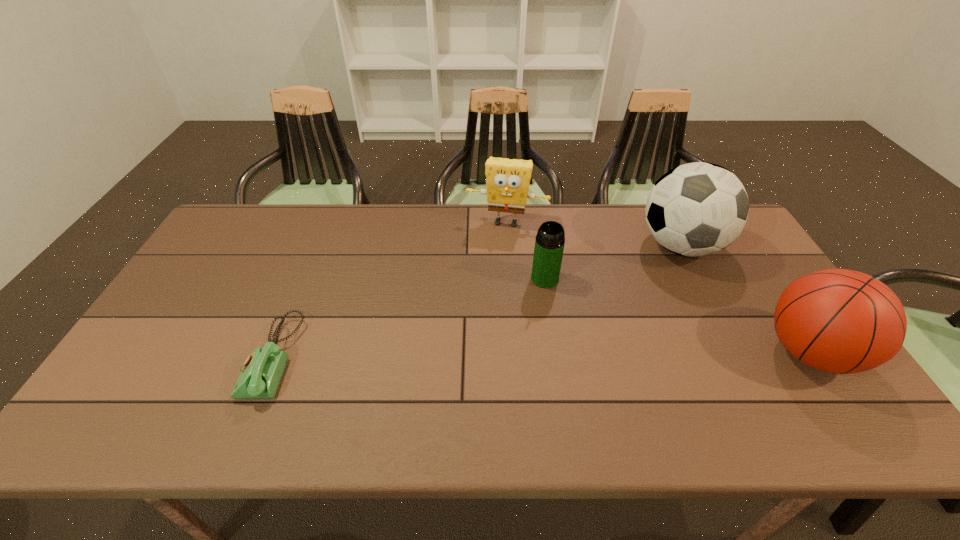
The image size is (960, 540). What are the coordinates of `free space located 0.360m on the face of the sponge` in the screenshot? It's located at (483, 313).

Locate an element on the screen. The image size is (960, 540). vacant space located on the face of the sponge is located at coordinates (481, 321).

Find the location of a particular element. The width and height of the screenshot is (960, 540). free space located 0.390m on the face of the sponge is located at coordinates [x=481, y=321].

The height and width of the screenshot is (540, 960). Identify the location of free location located from the spout of the thermos bottle. (485, 390).

Find the location of `blank space located 0.310m from the spout of the thermos bottle`. blank space located 0.310m from the spout of the thermos bottle is located at coordinates (496, 368).

Find the location of `vacant space located from the spout of the thermos bottle`. vacant space located from the spout of the thermos bottle is located at coordinates (526, 313).

Identify the location of vacant space situated 0.140m on the main logo of the soccer ball. The height and width of the screenshot is (540, 960). (639, 293).

In order to click on blank space located on the main logo of the soccer ball in this screenshot , I will do `click(615, 320)`.

Identify the location of free space located on the main logo of the soccer ball. (608, 329).

Identify the location of sponge located in the far edge section of the desktop. (507, 180).